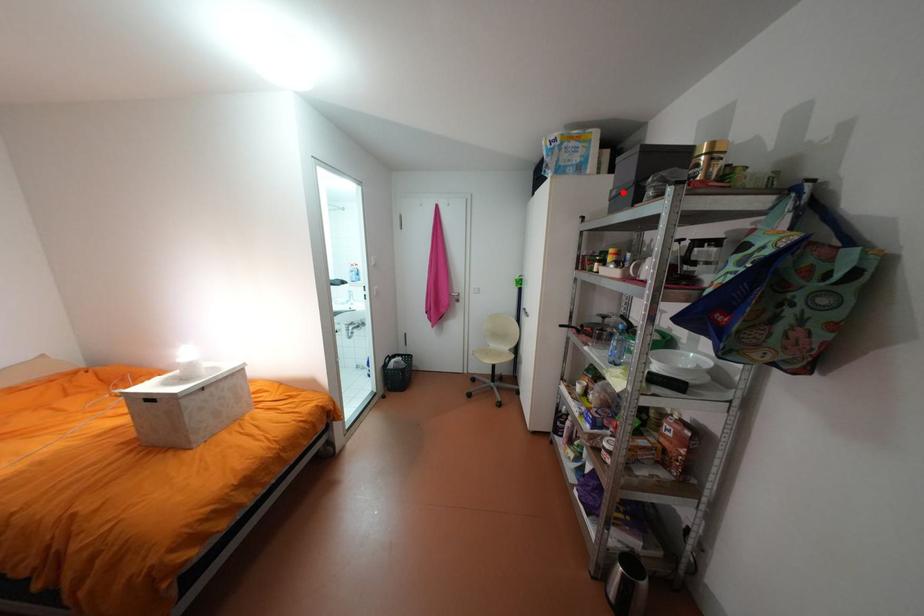
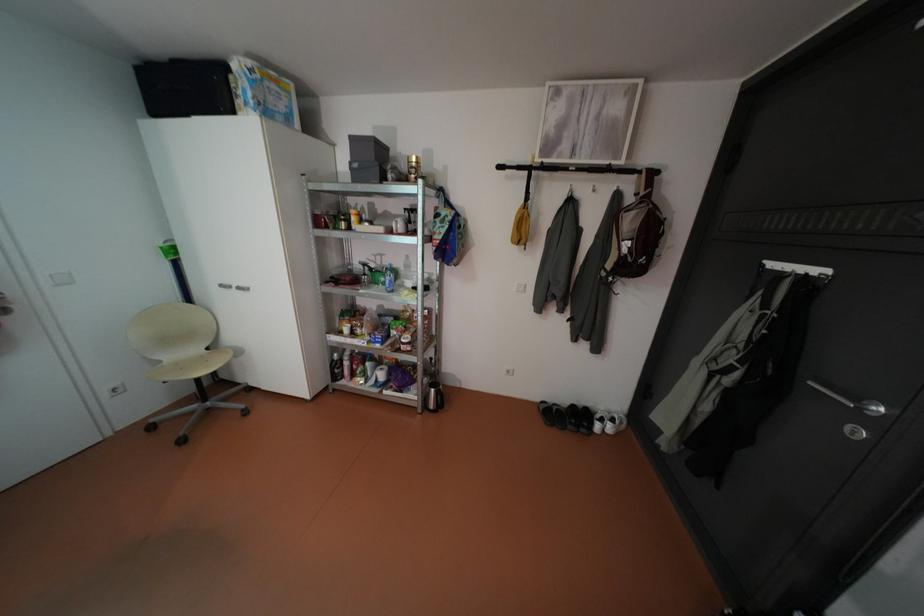
Where in the second image is the point corresponding to the highlighted location from the first image?

(365, 164)